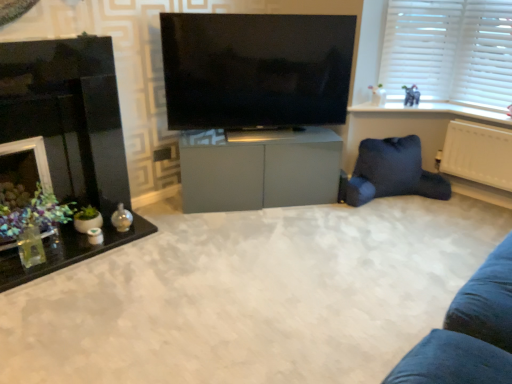
Question: Is dark blue fabric bean bag at lower right to the left of matte gray elephant at upper right from the viewer's perspective?

Choices:
 (A) no
 (B) yes

Answer: (B)

Question: Is dark blue fabric bean bag at lower right positioned in front of matte gray elephant at upper right?

Choices:
 (A) no
 (B) yes

Answer: (B)

Question: Can you confirm if dark blue fabric bean bag at lower right is bigger than matte gray elephant at upper right?

Choices:
 (A) yes
 (B) no

Answer: (A)

Question: From a real-world perspective, is dark blue fabric bean bag at lower right positioned under matte gray elephant at upper right based on gravity?

Choices:
 (A) yes
 (B) no

Answer: (A)

Question: Is dark blue fabric bean bag at lower right wider than matte gray elephant at upper right?

Choices:
 (A) yes
 (B) no

Answer: (A)

Question: Choose the correct answer: Is flat screen tv at center inside dark blue fabric bean bag at lower right or outside it?

Choices:
 (A) outside
 (B) inside

Answer: (A)

Question: In terms of width, does flat screen tv at center look wider or thinner when compared to dark blue fabric bean bag at lower right?

Choices:
 (A) wide
 (B) thin

Answer: (B)

Question: Considering the positions of flat screen tv at center and dark blue fabric bean bag at lower right in the image, is flat screen tv at center bigger or smaller than dark blue fabric bean bag at lower right?

Choices:
 (A) big
 (B) small

Answer: (A)

Question: Visually, is flat screen tv at center positioned to the left or to the right of dark blue fabric bean bag at lower right?

Choices:
 (A) left
 (B) right

Answer: (A)

Question: Relative to matte gray cabinet at center, is white plastic blinds at upper right in front or behind?

Choices:
 (A) behind
 (B) front

Answer: (A)

Question: In the image, is white plastic blinds at upper right on the left side or the right side of matte gray cabinet at center?

Choices:
 (A) right
 (B) left

Answer: (A)

Question: Does point (424, 29) appear closer or farther from the camera than point (184, 162)?

Choices:
 (A) farther
 (B) closer

Answer: (A)

Question: Looking at the image, does white plastic blinds at upper right seem bigger or smaller compared to matte gray cabinet at center?

Choices:
 (A) small
 (B) big

Answer: (A)

Question: Considering the positions of white plastic blinds at upper right and matte gray cabinet at center in the image, is white plastic blinds at upper right taller or shorter than matte gray cabinet at center?

Choices:
 (A) tall
 (B) short

Answer: (A)

Question: In the image, is white plastic blinds at upper right on the left side or the right side of matte gray cabinet at center?

Choices:
 (A) left
 (B) right

Answer: (B)